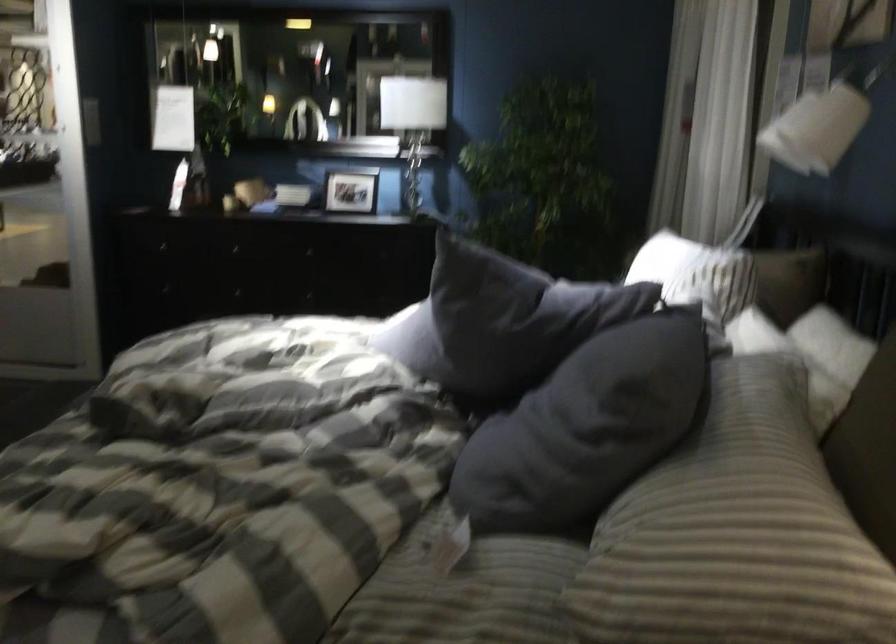
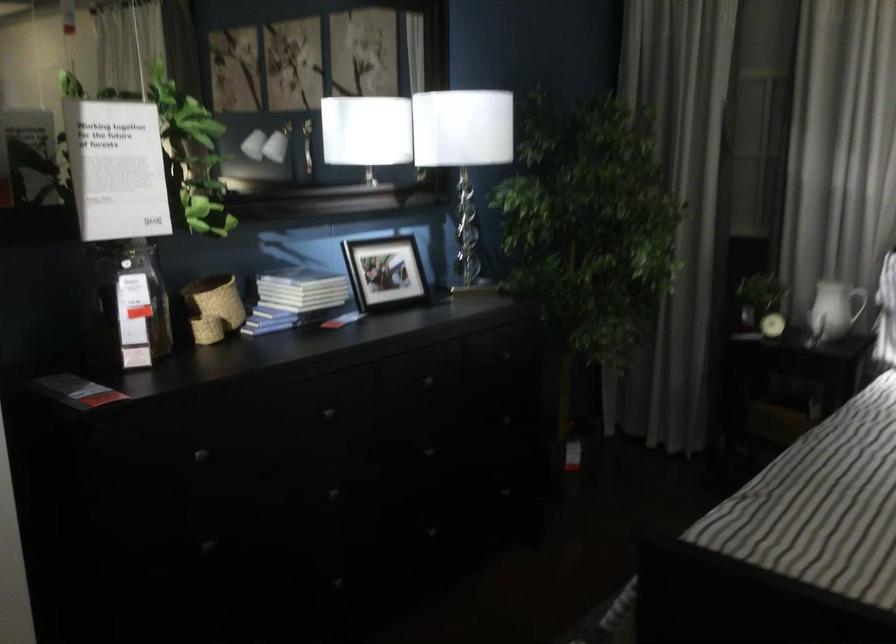
Find the pixel in the second image that matches [239,162] in the first image.

(213, 307)